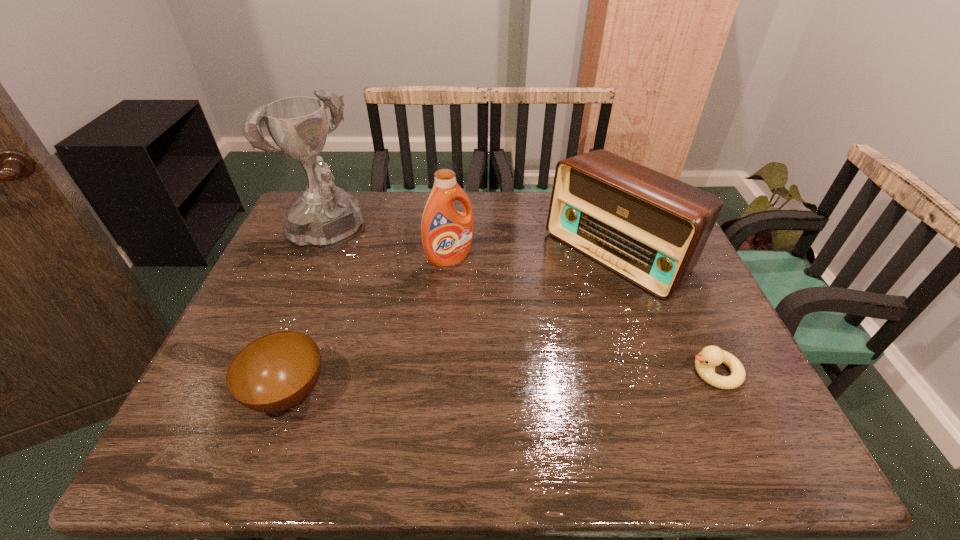
In order to click on vacant space on the desktop that is between the bowl and the duckling and is positioned on the front-facing side of the second tallest object in this screenshot , I will do `click(555, 380)`.

I want to click on vacant space on the desktop that is between the bowl and the duckling and is positioned on the side with emblem of the tallest object, so click(x=490, y=383).

This screenshot has height=540, width=960. Identify the location of vacant spot on the desktop that is between the bowl and the duckling and is positioned on the front-facing side of the third tallest object. (444, 386).